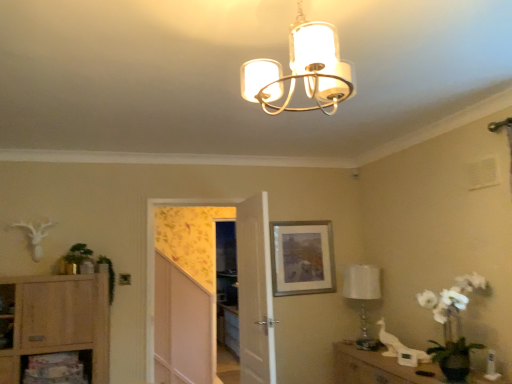
Question: Considering the relative positions of white matte chandelier at upper center, the 2th lamp from the bottom, and green leafy plant at left, the second plant from the right, in the image provided, is white matte chandelier at upper center, the 2th lamp from the bottom, to the left or to the right of green leafy plant at left, the second plant from the right,?

Choices:
 (A) left
 (B) right

Answer: (B)

Question: Considering their positions, is white matte chandelier at upper center, which is the 1th lamp from front to back, located in front of or behind green leafy plant at left, which appears as the 1th plant when viewed from the left?

Choices:
 (A) behind
 (B) front

Answer: (B)

Question: Which object is positioned farthest from the transparent glass screen door at center?

Choices:
 (A) wooden cabinet at lower right
 (B) wooden shelf at lower left
 (C) white matte chandelier at upper center, the 2th lamp from the bottom
 (D) light wood cabinet at lower left
 (E) white glass lamp at right, the 2th lamp viewed from the front

Answer: (C)

Question: Which is farther from the wooden shelf at lower left?

Choices:
 (A) green leafy plant at left, marked as the first plant in a right-to-left arrangement
 (B) white wooden door at center
 (C) green leafy plant at left, which appears as the 1th plant when viewed from the left
 (D) silver/metallic picture frame at center
 (E) transparent glass screen door at center

Answer: (D)